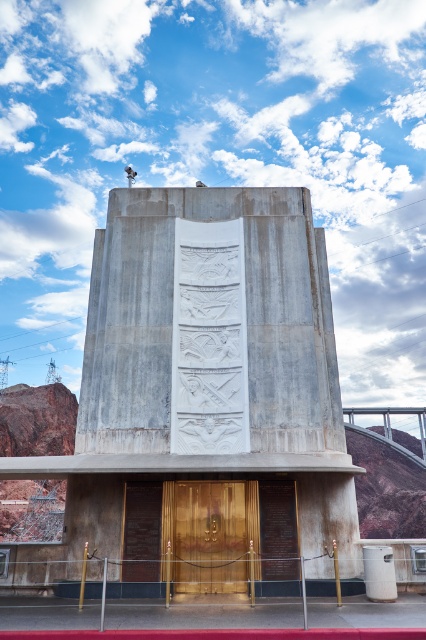
Question: Among these objects, which one is farthest from the camera?

Choices:
 (A) polished wood door at center
 (B) concreteroughmonument at lower center

Answer: (A)

Question: Is concreteroughmonument at lower center to the right of polished wood door at center from the viewer's perspective?

Choices:
 (A) yes
 (B) no

Answer: (A)

Question: Which of the following is the farthest from the observer?

Choices:
 (A) (164, 545)
 (B) (115, 616)

Answer: (A)

Question: Can you confirm if concreteroughmonument at lower center is positioned to the right of polished wood door at center?

Choices:
 (A) no
 (B) yes

Answer: (B)

Question: Can you confirm if concreteroughmonument at lower center is positioned to the right of polished wood door at center?

Choices:
 (A) yes
 (B) no

Answer: (A)